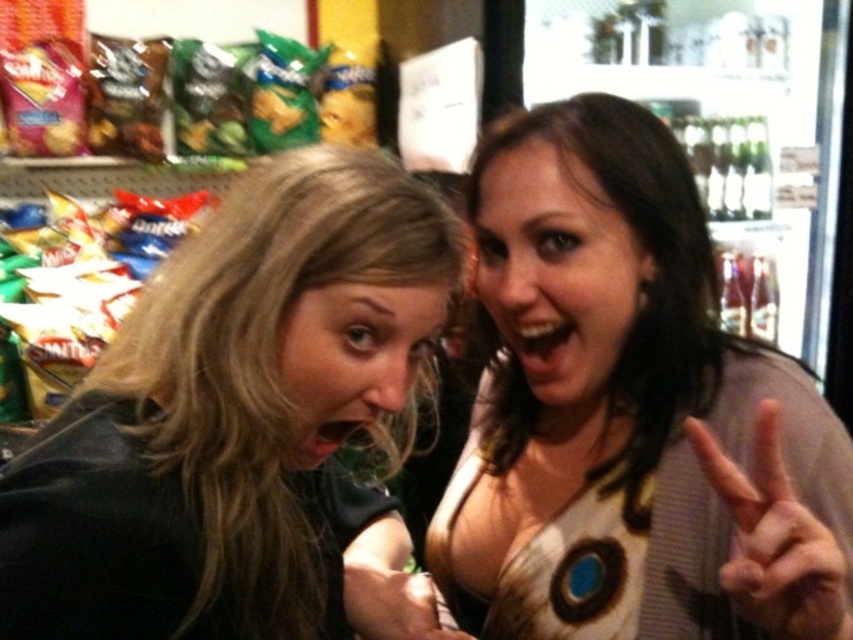
You are a photographer trying to capture a candid shot of the dark brown hair at left and the white matte hand at center right. Which object should you focus on first if you want to capture both in the same frame without moving the camera?

The dark brown hair at left is positioned on the left side of white matte hand at center right, so you should focus on the dark brown hair at left first to ensure both are in the frame.

You are standing in a convenience store and see two people. The person on the left has dark brown hair at left, and the person on the right has a white matte hand at center right. Which object is closer to the bottom of the image?

The dark brown hair at left is positioned under the white matte hand at center right, so the dark brown hair at left is closer to the bottom of the image.

You are a cashier at a store and see a customer holding the white matte chips at left and the white matte hand at center right. Which object is closer to the right side of the shelf?

The white matte hand at center right is positioned on the right side of the white matte chips at left, so it is closer to the right side of the shelf.